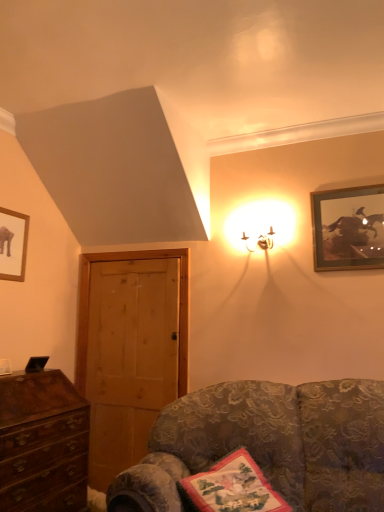
Question: Considering the relative sizes of matte black picture frame at upper left, which is the second picture frame in right-to-left order, and metallic gold sconce at upper right in the image provided, is matte black picture frame at upper left, which is the second picture frame in right-to-left order, shorter than metallic gold sconce at upper right?

Choices:
 (A) no
 (B) yes

Answer: (A)

Question: Is matte black picture frame at upper left, which is the second picture frame in right-to-left order, turned away from metallic gold sconce at upper right?

Choices:
 (A) no
 (B) yes

Answer: (A)

Question: Is matte black picture frame at upper left, which is the second picture frame in right-to-left order, outside metallic gold sconce at upper right?

Choices:
 (A) no
 (B) yes

Answer: (B)

Question: Can you see matte black picture frame at upper left, which is the second picture frame in right-to-left order, touching metallic gold sconce at upper right?

Choices:
 (A) no
 (B) yes

Answer: (A)

Question: Is matte black picture frame at upper left, which is the second picture frame in right-to-left order, smaller than metallic gold sconce at upper right?

Choices:
 (A) yes
 (B) no

Answer: (A)

Question: Is point [x=286, y=508] closer or farther from the camera than point [x=102, y=431]?

Choices:
 (A) closer
 (B) farther

Answer: (A)

Question: Considering the relative positions of silk floral pillow at lower right and wooden door at left in the image provided, is silk floral pillow at lower right to the left or to the right of wooden door at left?

Choices:
 (A) left
 (B) right

Answer: (B)

Question: Considering the positions of silk floral pillow at lower right and wooden door at left in the image, is silk floral pillow at lower right taller or shorter than wooden door at left?

Choices:
 (A) tall
 (B) short

Answer: (B)

Question: Which is correct: silk floral pillow at lower right is inside wooden door at left, or outside of it?

Choices:
 (A) inside
 (B) outside

Answer: (B)

Question: Is velvet floral couch at lower right situated inside metallic gold sconce at upper right or outside?

Choices:
 (A) outside
 (B) inside

Answer: (A)

Question: Based on their positions, is velvet floral couch at lower right located to the left or right of metallic gold sconce at upper right?

Choices:
 (A) left
 (B) right

Answer: (A)

Question: From the image's perspective, relative to metallic gold sconce at upper right, is velvet floral couch at lower right above or below?

Choices:
 (A) below
 (B) above

Answer: (A)

Question: In terms of size, does velvet floral couch at lower right appear bigger or smaller than metallic gold sconce at upper right?

Choices:
 (A) small
 (B) big

Answer: (B)

Question: Looking at the image, does mahogany wooden chest of drawers at lower left seem bigger or smaller compared to wooden door at left?

Choices:
 (A) small
 (B) big

Answer: (B)

Question: Would you say mahogany wooden chest of drawers at lower left is inside or outside wooden door at left?

Choices:
 (A) outside
 (B) inside

Answer: (A)